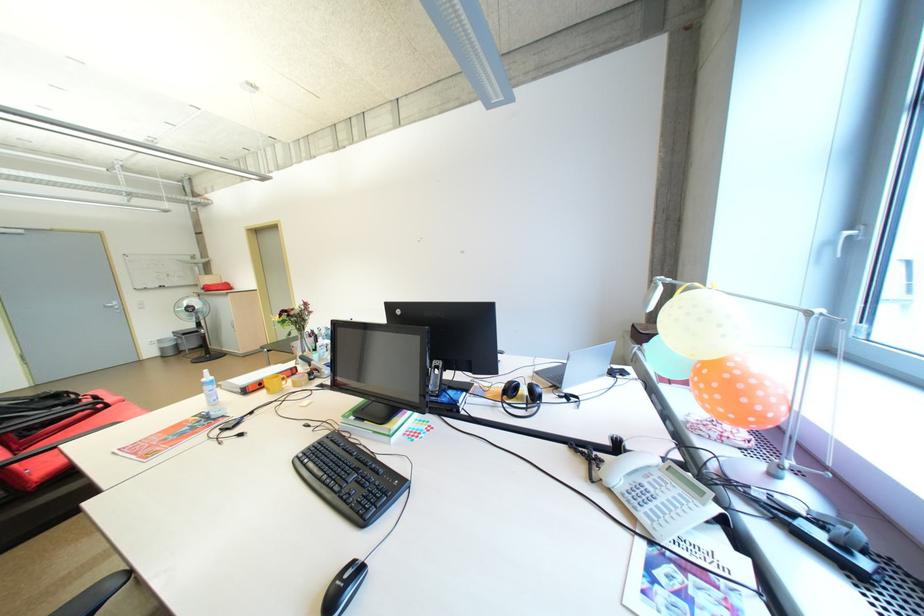
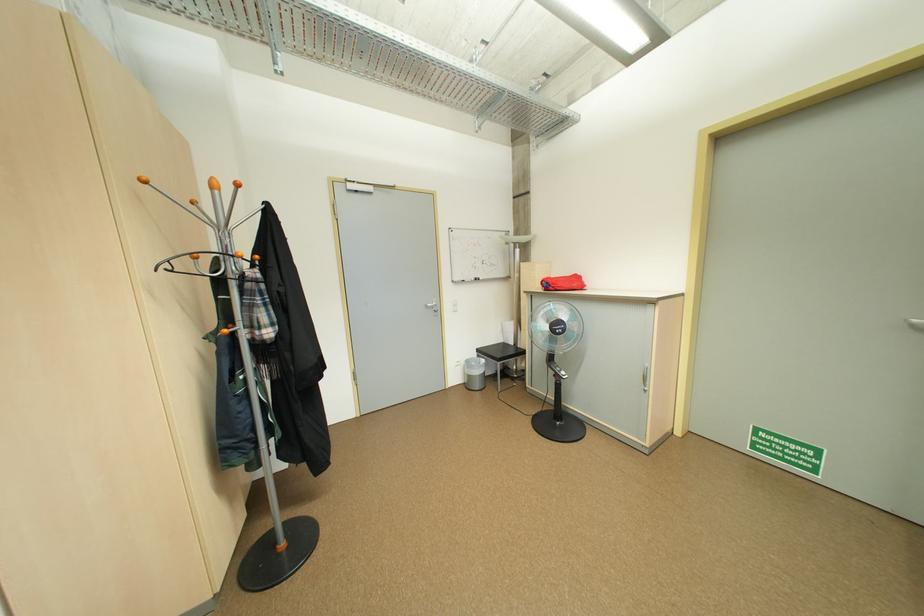
The point at (180, 336) is marked in the first image. Where is the corresponding point in the second image?

(483, 355)